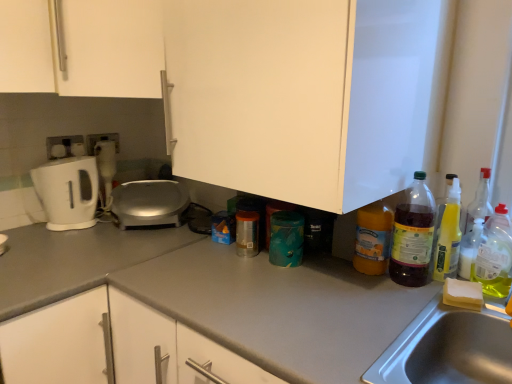
Question: Is white matte cabinet at upper left, placed as the 2th cabinetry when sorted from right to left, to the left or to the right of yellow translucent spray bottle at right, which ranks as the fourth bottle in left-to-right order, in the image?

Choices:
 (A) left
 (B) right

Answer: (A)

Question: Considering the positions of white matte cabinet at upper left, marked as the 1th cabinetry in a left-to-right arrangement, and yellow translucent spray bottle at right, which ranks as the fourth bottle in left-to-right order, in the image, is white matte cabinet at upper left, marked as the 1th cabinetry in a left-to-right arrangement, bigger or smaller than yellow translucent spray bottle at right, which ranks as the fourth bottle in left-to-right order,?

Choices:
 (A) big
 (B) small

Answer: (A)

Question: Which of these objects is positioned closest to the clear plastic bottle at right, which is the first bottle from right to left?

Choices:
 (A) satin silver appliance at center
 (B) translucent plastic bottle at right, placed as the second bottle when sorted from left to right
 (C) gray matte countertop at center
 (D) white plastic coffee machine at left
 (E) white glossy electric kettle at left

Answer: (B)

Question: Considering the real-world distances, which object is closest to the satin silver appliance at center?

Choices:
 (A) orange matte bottle at lower right, arranged as the 5th bottle when viewed from the right
 (B) translucent plastic spray bottle at right, which is the 3th bottle in left-to-right order
 (C) white glossy electric kettle at left
 (D) white plastic coffee machine at left
 (E) white matte cabinet at upper left, placed as the 2th cabinetry when sorted from right to left

Answer: (C)